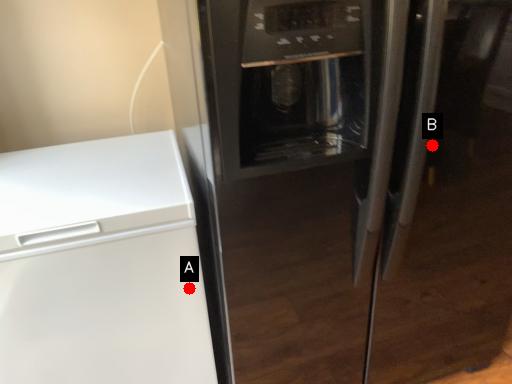
Question: Two points are circled on the image, labeled by A and B beside each circle. Which point appears closest to the camera in this image?

Choices:
 (A) A is closer
 (B) B is closer

Answer: (B)